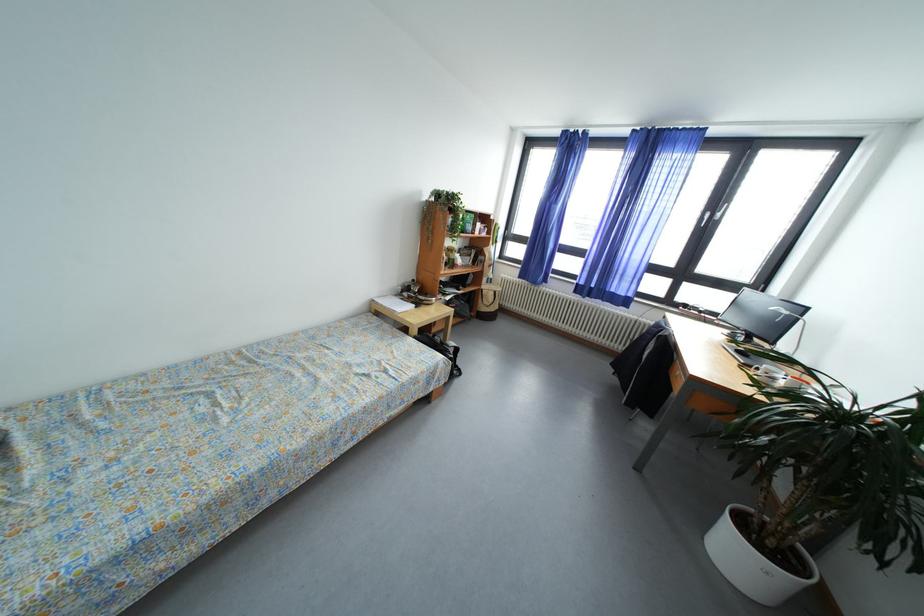
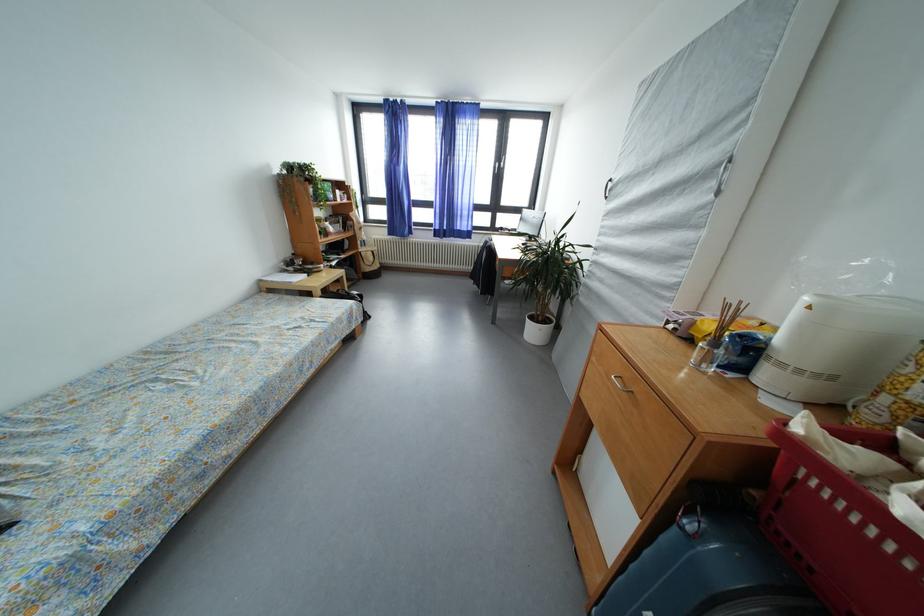
Question: The camera is either moving clockwise (left) or counter-clockwise (right) around the object. The first image is from the beginning of the video and the second image is from the end. Is the camera moving left or right when shooting the video?

Choices:
 (A) Left
 (B) Right

Answer: (A)